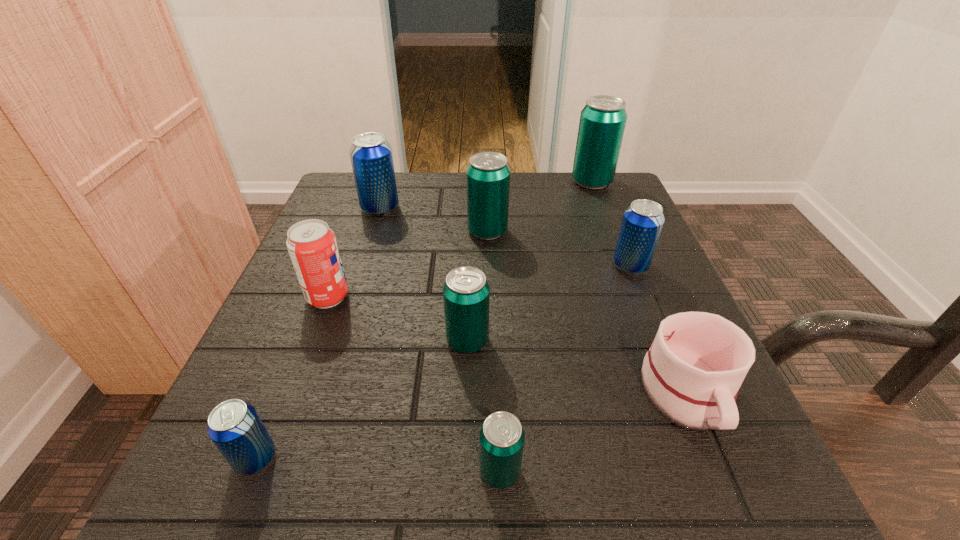
This screenshot has height=540, width=960. I want to click on vacant area that lies between the nearest blue beer can and the mug, so click(x=471, y=426).

I want to click on empty space between the mug and the farthest teal beer can, so click(x=639, y=288).

Identify the location of vacant space that's between the nearest blue beer can and the nearest teal beer can. Image resolution: width=960 pixels, height=540 pixels. (377, 464).

The image size is (960, 540). I want to click on free spot between the fourth farthest beer can and the third farthest teal beer can, so click(x=549, y=303).

At what (x,y) coordinates should I click in order to perform the action: click on empty space between the second biggest teal beer can and the farthest beer can. Please return your answer as a coordinate pair (x, y). Image resolution: width=960 pixels, height=540 pixels. Looking at the image, I should click on (540, 207).

Identify the location of free spot between the farthest object and the mug. This screenshot has height=540, width=960. pos(639,288).

Where is `empty space between the farthest object and the third biggest teal beer can`? The image size is (960, 540). empty space between the farthest object and the third biggest teal beer can is located at coordinates (530, 261).

Point out which object is positioned as the fifth nearest to the second smallest blue beer can. Please provide its 2D coordinates. Your answer should be formatted as a tuple, i.e. [(x, y)], where the tuple contains the x and y coordinates of a point satisfying the conditions above.

[(501, 439)]

The height and width of the screenshot is (540, 960). Identify the location of object that is the fourth closest to the second nearest blue beer can. (466, 293).

Find the location of a particular element. beer can that is the fourth closest one to the soda can is located at coordinates (488, 175).